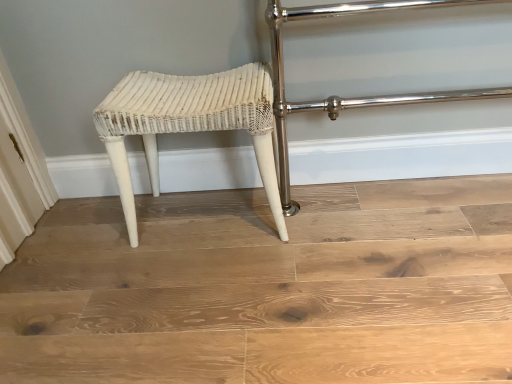
This screenshot has height=384, width=512. I want to click on free space in front of white wicker stool at center, so click(206, 291).